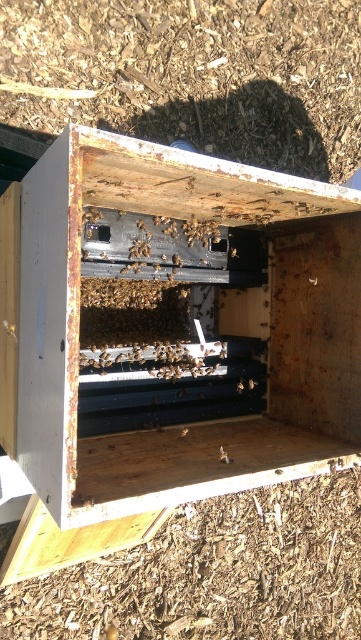
Does rusty metal beehive at center have a larger size compared to translucent yellowish honeycomb at center?

Yes, rusty metal beehive at center is bigger than translucent yellowish honeycomb at center.

Who is higher up, rusty metal beehive at center or translucent yellowish honeycomb at center?

Positioned higher is rusty metal beehive at center.

This screenshot has width=361, height=640. Identify the location of rusty metal beehive at center. (202, 323).

Between translucent yellowish bee at center and translucent yellowish honeycomb at center, which one appears on the right side from the viewer's perspective?

translucent yellowish bee at center is more to the right.

Which is in front, point (222, 461) or point (186, 429)?

Point (222, 461)

Locate an element on the screen. The width and height of the screenshot is (361, 640). translucent yellowish bee at center is located at coordinates (223, 456).

Consider the image. Does rusty metal beehive at center appear on the left side of translucent yellowish bee at center?

Indeed, rusty metal beehive at center is positioned on the left side of translucent yellowish bee at center.

What do you see at coordinates (202, 323) in the screenshot? I see `rusty metal beehive at center` at bounding box center [202, 323].

Which is behind, point (171, 481) or point (219, 458)?

Point (219, 458)

Identify the location of rusty metal beehive at center. (202, 323).